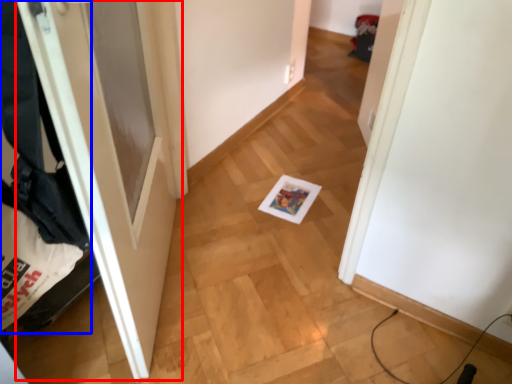
Question: Which object is closer to the camera taking this photo, door (highlighted by a red box) or laundry (highlighted by a blue box)?

Choices:
 (A) door
 (B) laundry

Answer: (B)